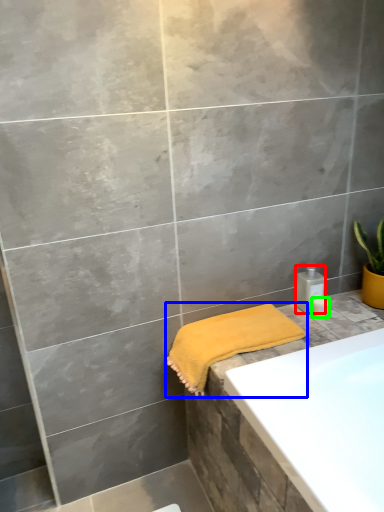
Question: Which is farther away from toiletry (highlighted by a red box)? towel (highlighted by a blue box) or toiletry (highlighted by a green box)?

Choices:
 (A) towel
 (B) toiletry

Answer: (A)